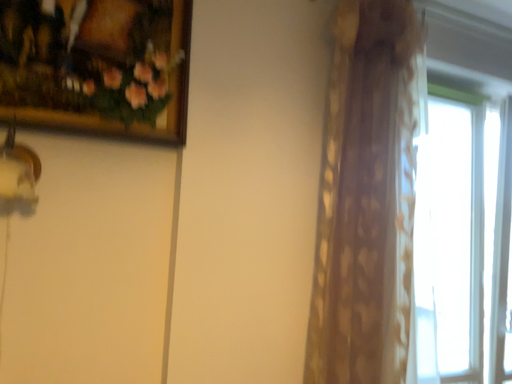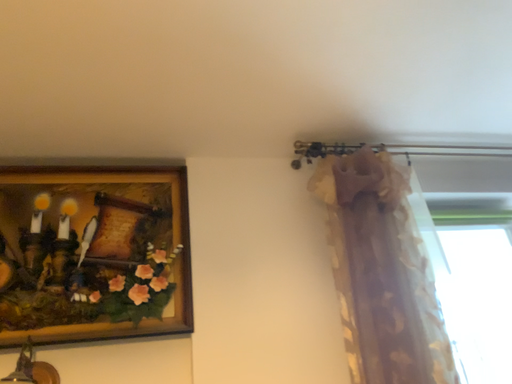
Question: How did the camera likely rotate when shooting the video?

Choices:
 (A) rotated downward
 (B) rotated upward

Answer: (B)